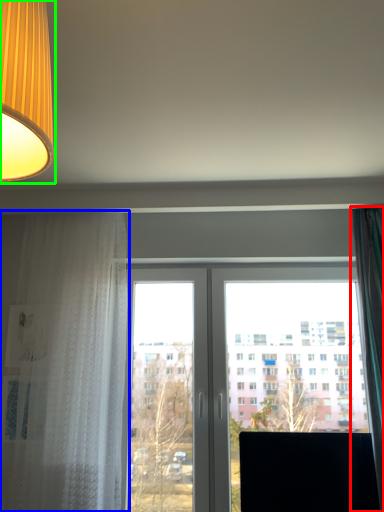
Question: Estimate the real-world distances between objects in this image. Which object is farther from curtain (highlighted by a red box), curtain (highlighted by a blue box) or lamp (highlighted by a green box)?

Choices:
 (A) curtain
 (B) lamp

Answer: (B)